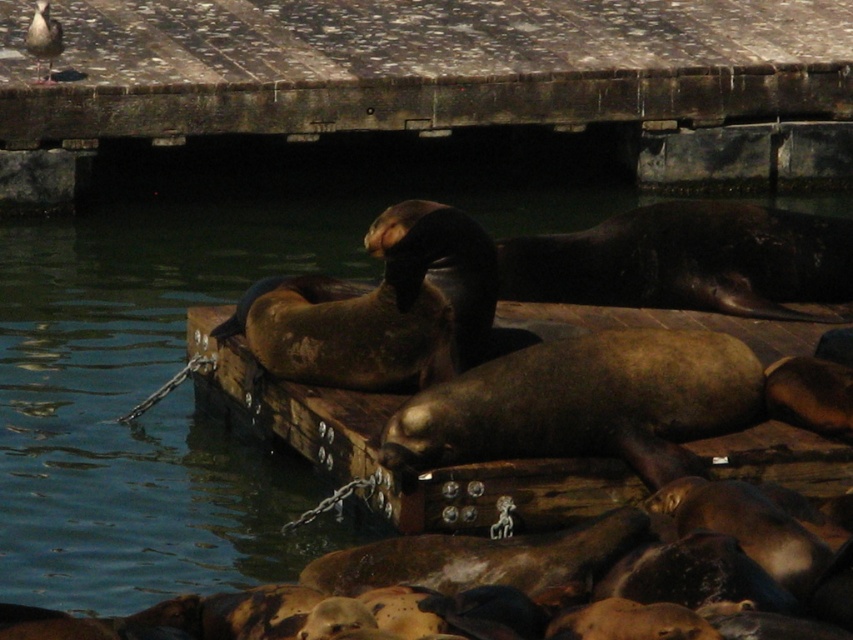
Question: Is weathered wood dock at upper center closer to camera compared to white feathered bird at upper left?

Choices:
 (A) no
 (B) yes

Answer: (A)

Question: Among these points, which one is nearest to the camera?

Choices:
 (A) (61, 38)
 (B) (146, 65)

Answer: (A)

Question: Is weathered wood dock at upper center further to camera compared to brown water at center?

Choices:
 (A) yes
 (B) no

Answer: (A)

Question: Does weathered wood dock at upper center appear over brown water at center?

Choices:
 (A) no
 (B) yes

Answer: (B)

Question: Which object appears farthest from the camera in this image?

Choices:
 (A) white feathered bird at upper left
 (B) brown water at center
 (C) weathered wood dock at upper center

Answer: (C)

Question: Estimate the real-world distances between objects in this image. Which object is closer to the brown water at center?

Choices:
 (A) weathered wood dock at upper center
 (B) white feathered bird at upper left

Answer: (A)